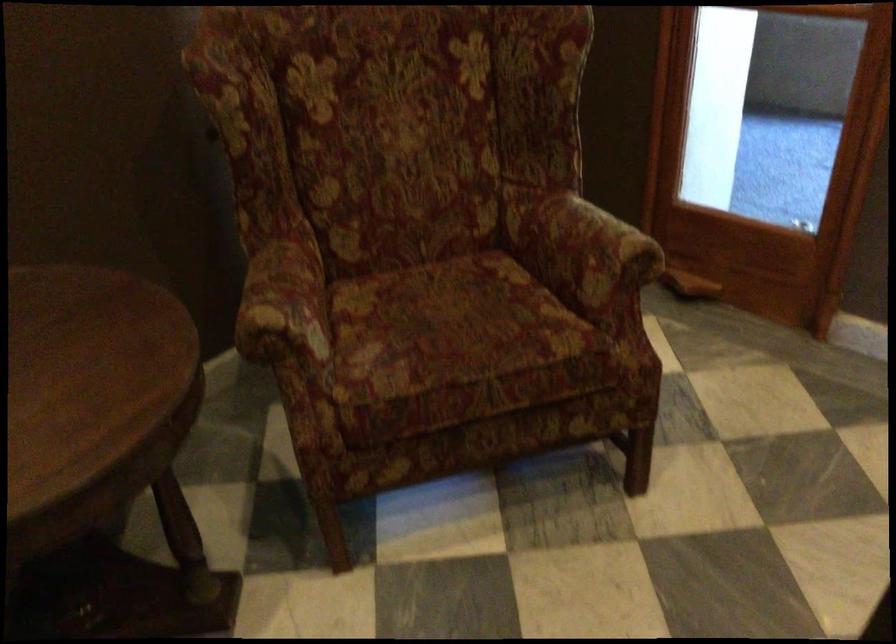
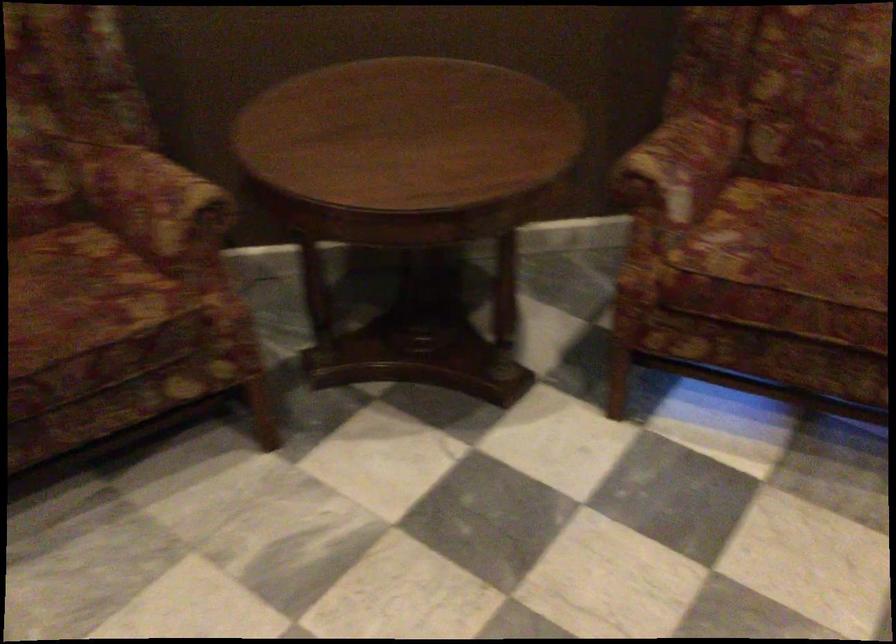
Where in the second image is the point corresponding to (x=303, y=299) from the first image?

(679, 164)